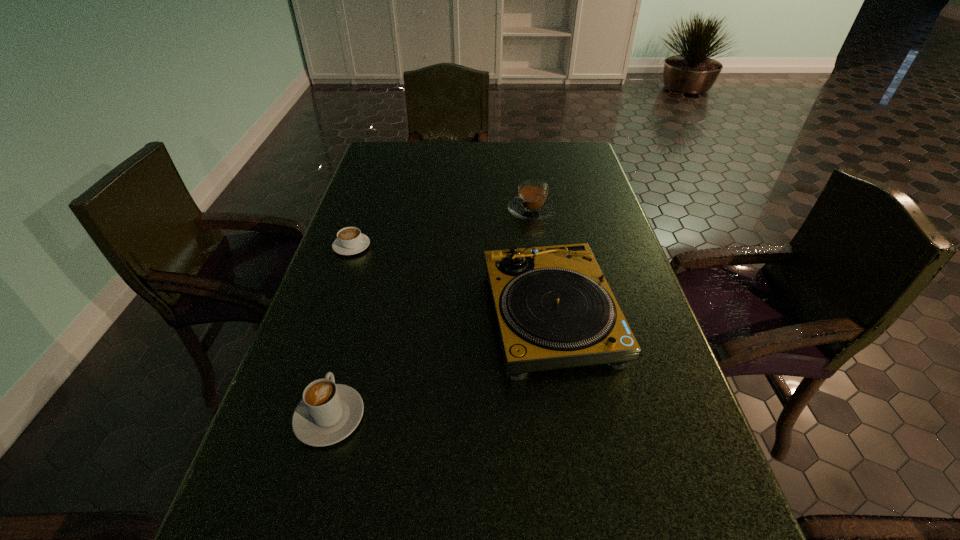
Point out which cappuccino is positioned as the nearest to the nearest object. Please provide its 2D coordinates. Your answer should be formatted as a tuple, i.e. [(x, y)], where the tuple contains the x and y coordinates of a point satisfying the conditions above.

[(350, 240)]

Where is `cappuccino that is the second closest one to the shortest object`? cappuccino that is the second closest one to the shortest object is located at coordinates (328, 412).

The width and height of the screenshot is (960, 540). Find the location of `free space that satisfies the following two spatial constraints: 1. on the side of the second nearest cappuccino with the handle; 2. to the right of the nearest cappuccino`. free space that satisfies the following two spatial constraints: 1. on the side of the second nearest cappuccino with the handle; 2. to the right of the nearest cappuccino is located at coordinates (292, 417).

Identify the location of free point that satisfies the following two spatial constraints: 1. to the right of the record player; 2. on the left side of the nearest object. The width and height of the screenshot is (960, 540). (358, 315).

Find the location of a particular element. free point that satisfies the following two spatial constraints: 1. on the side of the second farthest cappuccino with the handle; 2. to the right of the nearest cappuccino is located at coordinates (292, 417).

The height and width of the screenshot is (540, 960). Find the location of `vacant region that satisfies the following two spatial constraints: 1. on the front side of the farthest object; 2. on the left side of the third farthest object`. vacant region that satisfies the following two spatial constraints: 1. on the front side of the farthest object; 2. on the left side of the third farthest object is located at coordinates (548, 315).

Find the location of `free space that satisfies the following two spatial constraints: 1. to the right of the nearest cappuccino; 2. on the left side of the record player`. free space that satisfies the following two spatial constraints: 1. to the right of the nearest cappuccino; 2. on the left side of the record player is located at coordinates (358, 315).

This screenshot has width=960, height=540. I want to click on free space that satisfies the following two spatial constraints: 1. to the right of the nearest object; 2. on the side of the shortest cappuccino with the handle, so click(x=377, y=246).

Locate an element on the screen. vacant position in the image that satisfies the following two spatial constraints: 1. on the front side of the farthest object; 2. on the side of the second farthest cappuccino with the handle is located at coordinates (538, 246).

Find the location of a particular element. The height and width of the screenshot is (540, 960). vacant space that satisfies the following two spatial constraints: 1. to the right of the tallest object; 2. on the right side of the nearest cappuccino is located at coordinates point(358,315).